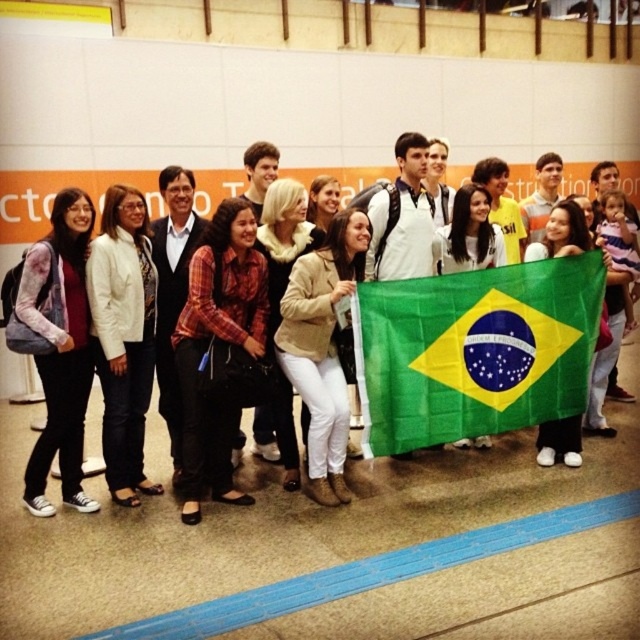
You are a photographer trying to capture a group photo. You need to ensure that both the green fabric flag at center and the matte black backpack at lower left are visible in the frame. Given their distance apart, what is the minimum width of your camera lens in meters to include both objects?

The green fabric flag at center and the matte black backpack at lower left are 2.34 meters apart from each other. To include both in the frame, the camera lens must be at least 2.34 meters wide.

You are a photographer trying to capture a clear shot of the Brazilian flag held by the woman in the center. There are two matte black backpacks in your way. Which backpack is closer to the camera, the matte black backpack at lower left or the matte black backpack at center?

The matte black backpack at lower left is positioned under the matte black backpack at center, meaning the backpack at center is closer to the camera.